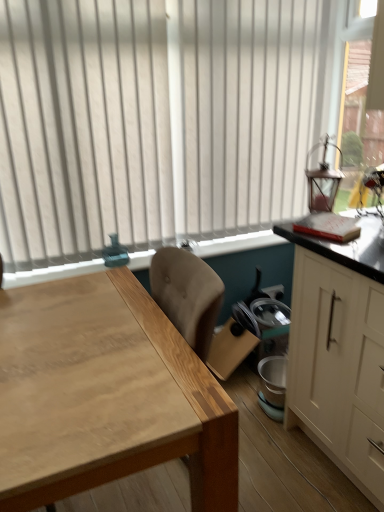
Question: In the image, is natural wood table at center positioned in front of or behind white matte cabinet at right?

Choices:
 (A) front
 (B) behind

Answer: (A)

Question: Is natural wood table at center to the left or to the right of white matte cabinet at right in the image?

Choices:
 (A) right
 (B) left

Answer: (B)

Question: Based on their relative distances, which object is nearer to the white matte cabinet at right?

Choices:
 (A) natural wood table at center
 (B) white vertical blinds at upper center
 (C) clear glass lantern at upper right

Answer: (A)

Question: Which object is positioned farthest from the white matte cabinet at right?

Choices:
 (A) natural wood table at center
 (B) clear glass lantern at upper right
 (C) white vertical blinds at upper center

Answer: (C)